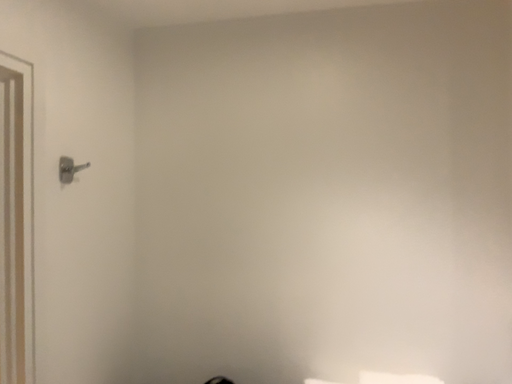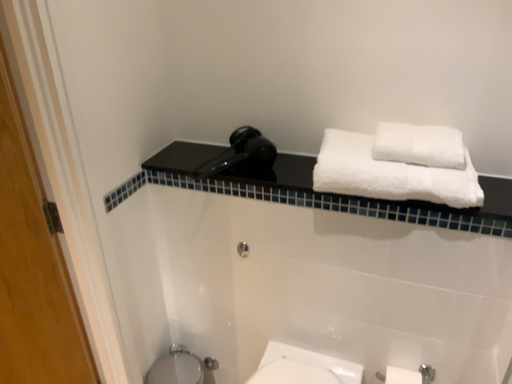
Question: Which way did the camera rotate in the video?

Choices:
 (A) rotated upward
 (B) rotated downward

Answer: (B)